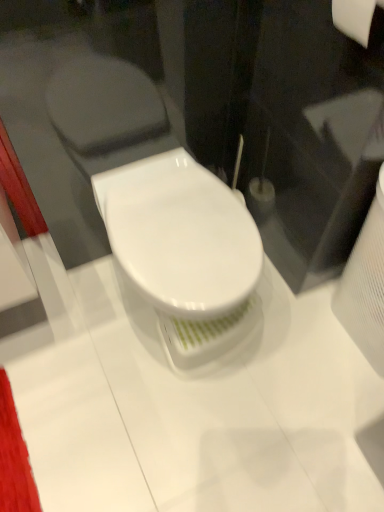
Locate an element on the screen. white matte toilet paper at upper right is located at coordinates (355, 18).

What do you see at coordinates (355, 18) in the screenshot? The width and height of the screenshot is (384, 512). I see `white matte toilet paper at upper right` at bounding box center [355, 18].

What do you see at coordinates (184, 251) in the screenshot? This screenshot has height=512, width=384. I see `white glossy toilet at center` at bounding box center [184, 251].

Find the location of a particular element. Image resolution: width=384 pixels, height=512 pixels. white glossy toilet at center is located at coordinates (184, 251).

Where is `white matte toilet paper at upper right`? white matte toilet paper at upper right is located at coordinates (355, 18).

Consider the image. Considering the relative positions of white glossy toilet at center and white matte toilet paper at upper right in the image provided, is white glossy toilet at center to the left of white matte toilet paper at upper right from the viewer's perspective?

Yes, white glossy toilet at center is to the left of white matte toilet paper at upper right.

Considering their positions, is white glossy toilet at center located in front of or behind white matte toilet paper at upper right?

Clearly, white glossy toilet at center is behind white matte toilet paper at upper right.

Considering the points (210, 271) and (346, 29), which point is behind, point (210, 271) or point (346, 29)?

The point (210, 271) is farther from the camera.

From the image's perspective, between white glossy toilet at center and white matte toilet paper at upper right, which one is located above?

white matte toilet paper at upper right appears higher in the image.

From a real-world perspective, is white glossy toilet at center located beneath white matte toilet paper at upper right?

Yes, from a real-world perspective, white glossy toilet at center is under white matte toilet paper at upper right.

Considering the relative sizes of white glossy toilet at center and white matte toilet paper at upper right in the image provided, is white glossy toilet at center wider than white matte toilet paper at upper right?

Yes, white glossy toilet at center is wider than white matte toilet paper at upper right.

Considering the sizes of objects white glossy toilet at center and white matte toilet paper at upper right in the image provided, who is taller, white glossy toilet at center or white matte toilet paper at upper right?

Standing taller between the two is white glossy toilet at center.

Looking at the image, does white glossy toilet at center seem bigger or smaller compared to white matte toilet paper at upper right?

white glossy toilet at center is bigger than white matte toilet paper at upper right.

Is white matte toilet paper at upper right located within white glossy toilet at center?

No, white glossy toilet at center does not contain white matte toilet paper at upper right.

Is white glossy toilet at center positioned far away from white matte toilet paper at upper right?

No, white glossy toilet at center is not far from white matte toilet paper at upper right.

Could you tell me if white glossy toilet at center is facing white matte toilet paper at upper right?

No, white glossy toilet at center is not turned towards white matte toilet paper at upper right.

What's the angular difference between white glossy toilet at center and white matte toilet paper at upper right's facing directions?

The angular difference between white glossy toilet at center and white matte toilet paper at upper right is 92.3 degrees.

Measure the distance between white glossy toilet at center and white matte toilet paper at upper right.

white glossy toilet at center and white matte toilet paper at upper right are 22.29 inches apart from each other.

This screenshot has width=384, height=512. I want to click on toilet paper that appears above the white glossy toilet at center (from a real-world perspective), so click(355, 18).

Is white matte toilet paper at upper right to the left or to the right of white glossy toilet at center in the image?

From the image, it's evident that white matte toilet paper at upper right is to the right of white glossy toilet at center.

Considering their positions, is white matte toilet paper at upper right located in front of or behind white glossy toilet at center?

Clearly, white matte toilet paper at upper right is in front of white glossy toilet at center.

Is point (372, 9) positioned behind point (177, 264)?

No.

From the image's perspective, which is above, white matte toilet paper at upper right or white glossy toilet at center?

white matte toilet paper at upper right appears higher in the image.

From a real-world perspective, is white matte toilet paper at upper right beneath white glossy toilet at center?

No.

Is white matte toilet paper at upper right wider or thinner than white glossy toilet at center?

Clearly, white matte toilet paper at upper right has less width compared to white glossy toilet at center.

Can you confirm if white matte toilet paper at upper right is shorter than white glossy toilet at center?

Yes.

In the scene shown: In terms of size, does white matte toilet paper at upper right appear bigger or smaller than white glossy toilet at center?

white matte toilet paper at upper right is smaller than white glossy toilet at center.

Is white glossy toilet at center inside white matte toilet paper at upper right?

No.

Is white matte toilet paper at upper right far away from white glossy toilet at center?

No, there isn't a large distance between white matte toilet paper at upper right and white glossy toilet at center.

Is white glossy toilet at center at the back of white matte toilet paper at upper right?

No.

Find the location of a particular element. toilet paper on the right of white glossy toilet at center is located at coordinates (355, 18).

Identify the location of toilet paper above the white glossy toilet at center (from a real-world perspective). The image size is (384, 512). [x=355, y=18].

The image size is (384, 512). In order to click on toilet paper in front of the white glossy toilet at center in this screenshot , I will do `click(355, 18)`.